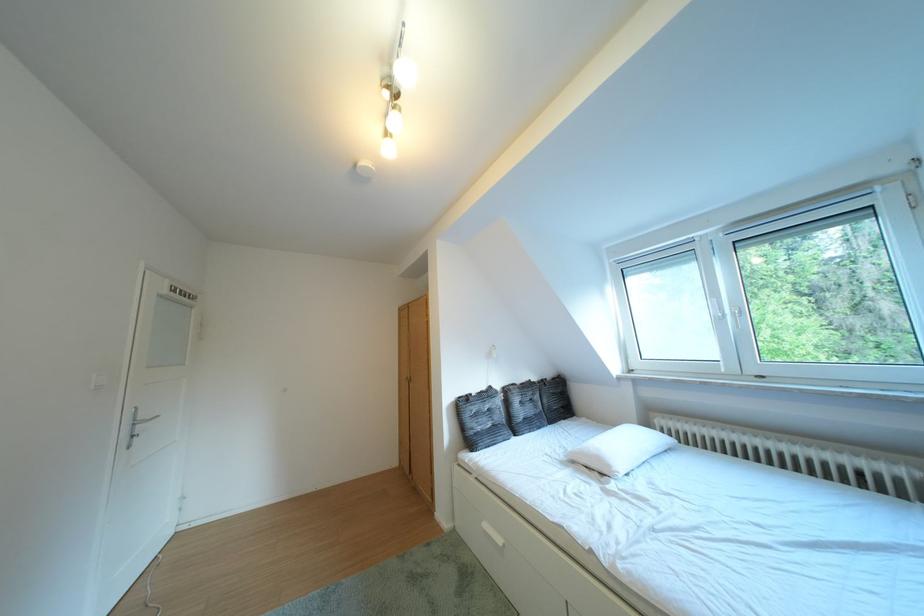
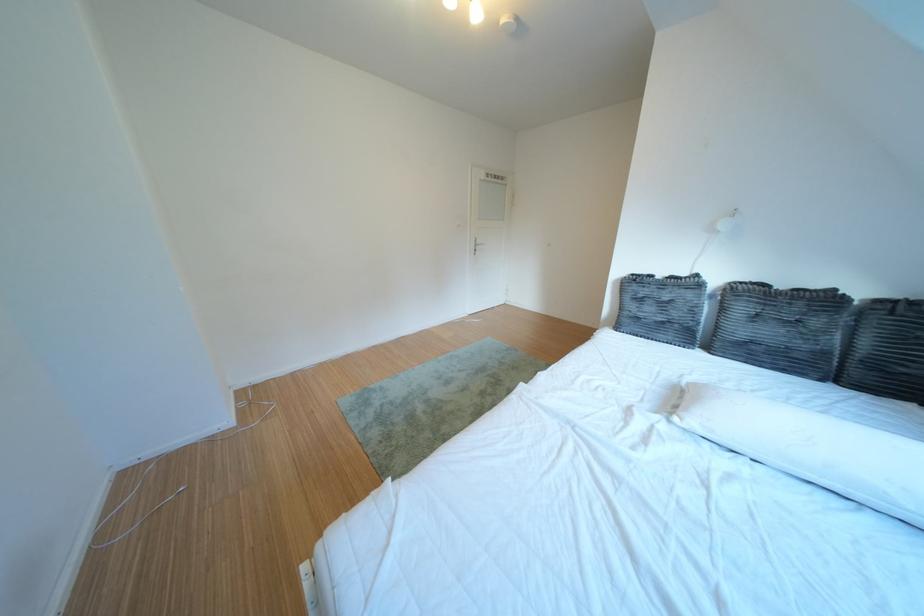
Locate, in the second image, the point that corresponds to pixel 555 386 in the first image.

(910, 306)